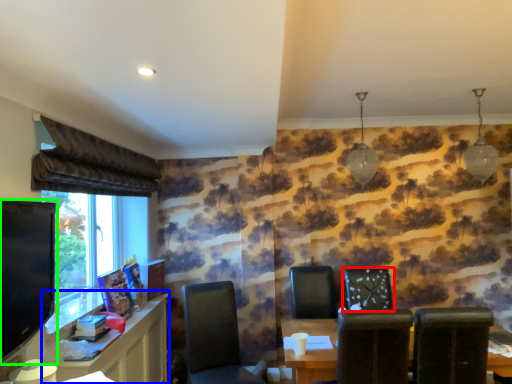
Question: Considering the real-world distances, which object is farthest from chair (highlighted by a red box)? computer desk (highlighted by a blue box) or television (highlighted by a green box)?

Choices:
 (A) computer desk
 (B) television

Answer: (B)